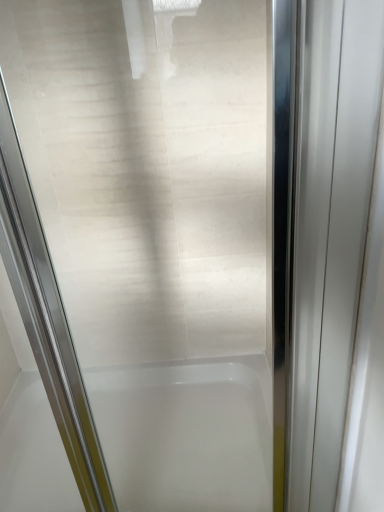
Question: Is white glossy bathtub at center bigger than polished chrome elevator door at right?

Choices:
 (A) no
 (B) yes

Answer: (B)

Question: Is white glossy bathtub at center at the left side of polished chrome elevator door at right?

Choices:
 (A) no
 (B) yes

Answer: (B)

Question: Can polished chrome elevator door at right be found inside white glossy bathtub at center?

Choices:
 (A) no
 (B) yes

Answer: (A)

Question: Is polished chrome elevator door at right at the back of white glossy bathtub at center?

Choices:
 (A) no
 (B) yes

Answer: (A)

Question: From a real-world perspective, is white glossy bathtub at center located beneath polished chrome elevator door at right?

Choices:
 (A) yes
 (B) no

Answer: (A)

Question: Is white glossy bathtub at center in front of polished chrome elevator door at right?

Choices:
 (A) yes
 (B) no

Answer: (B)

Question: From a real-world perspective, is polished chrome elevator door at right physically below white glossy bathtub at center?

Choices:
 (A) no
 (B) yes

Answer: (A)

Question: Is polished chrome elevator door at right positioned far away from white glossy bathtub at center?

Choices:
 (A) yes
 (B) no

Answer: (B)

Question: From a real-world perspective, is polished chrome elevator door at right on white glossy bathtub at center?

Choices:
 (A) no
 (B) yes

Answer: (B)

Question: Is white glossy bathtub at center completely or partially inside polished chrome elevator door at right?

Choices:
 (A) no
 (B) yes

Answer: (A)

Question: Considering the relative sizes of polished chrome elevator door at right and white glossy bathtub at center in the image provided, is polished chrome elevator door at right shorter than white glossy bathtub at center?

Choices:
 (A) no
 (B) yes

Answer: (A)

Question: Is polished chrome elevator door at right bigger than white glossy bathtub at center?

Choices:
 (A) yes
 (B) no

Answer: (B)

Question: Considering their positions, is polished chrome elevator door at right located in front of or behind white glossy bathtub at center?

Choices:
 (A) behind
 (B) front

Answer: (B)